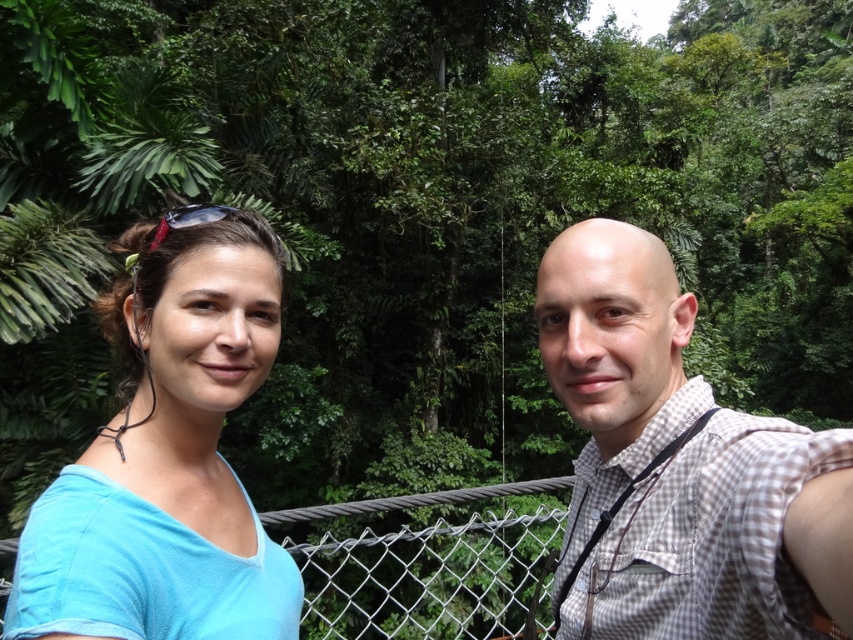
Between blue fabric shirt at left and light blue fabric at left, which one is positioned higher?

light blue fabric at left

Find the location of a particular element. Image resolution: width=853 pixels, height=640 pixels. blue fabric shirt at left is located at coordinates 679,467.

What are the coordinates of `blue fabric shirt at left` in the screenshot? It's located at (679, 467).

Is blue fabric shirt at left further to the viewer compared to wire mesh fence at center?

That is False.

Who is lower down, blue fabric shirt at left or wire mesh fence at center?

wire mesh fence at center is lower down.

The image size is (853, 640). What do you see at coordinates (679, 467) in the screenshot?
I see `blue fabric shirt at left` at bounding box center [679, 467].

Image resolution: width=853 pixels, height=640 pixels. I want to click on blue fabric shirt at left, so click(679, 467).

Which of these two, light blue fabric at left or wire mesh fence at center, stands taller?

Standing taller between the two is wire mesh fence at center.

Is point (144, 579) positioned behind point (355, 564)?

No, (144, 579) is closer to viewer.

Which is in front, point (144, 228) or point (410, 604)?

Point (144, 228) is in front.

Locate an element on the screen. This screenshot has width=853, height=640. light blue fabric at left is located at coordinates (167, 456).